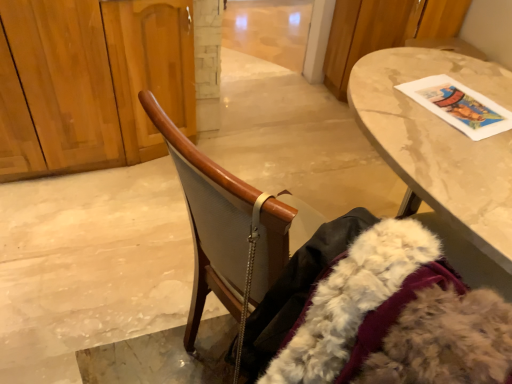
Question: Can you confirm if white fluffy fur coat at lower right is positioned to the left of wooden dresser at left?

Choices:
 (A) no
 (B) yes

Answer: (A)

Question: Does white fluffy fur coat at lower right have a lesser height compared to wooden dresser at left?

Choices:
 (A) no
 (B) yes

Answer: (A)

Question: Is white fluffy fur coat at lower right bigger than wooden dresser at left?

Choices:
 (A) yes
 (B) no

Answer: (B)

Question: From the image's perspective, is white fluffy fur coat at lower right under wooden dresser at left?

Choices:
 (A) yes
 (B) no

Answer: (A)

Question: Considering the relative sizes of white fluffy fur coat at lower right and wooden dresser at left in the image provided, is white fluffy fur coat at lower right wider than wooden dresser at left?

Choices:
 (A) no
 (B) yes

Answer: (B)

Question: From a real-world perspective, is white fluffy fur coat at lower right over wooden dresser at left?

Choices:
 (A) no
 (B) yes

Answer: (B)

Question: Considering the relative sizes of marble table at upper right and white fluffy fur coat at lower right in the image provided, is marble table at upper right shorter than white fluffy fur coat at lower right?

Choices:
 (A) yes
 (B) no

Answer: (A)

Question: Can you confirm if marble table at upper right is smaller than white fluffy fur coat at lower right?

Choices:
 (A) yes
 (B) no

Answer: (B)

Question: Is white fluffy fur coat at lower right surrounded by marble table at upper right?

Choices:
 (A) yes
 (B) no

Answer: (B)

Question: Is marble table at upper right at the left side of white fluffy fur coat at lower right?

Choices:
 (A) no
 (B) yes

Answer: (A)

Question: Is marble table at upper right at the right side of white fluffy fur coat at lower right?

Choices:
 (A) no
 (B) yes

Answer: (B)

Question: Would you say marble table at upper right is a long distance from white fluffy fur coat at lower right?

Choices:
 (A) no
 (B) yes

Answer: (A)

Question: Is wooden chair at center next to wooden dresser at left?

Choices:
 (A) yes
 (B) no

Answer: (B)